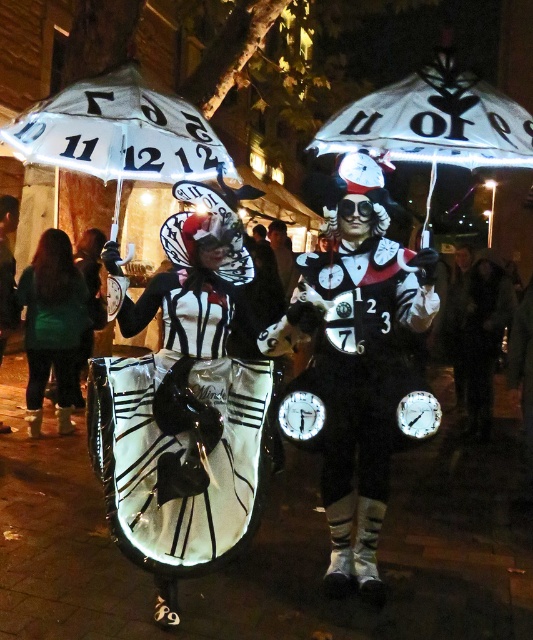
You are standing in the nighttime scene and need to find the exact location of the matte black fabric dress at center. According to the coordinates provided, where is it positioned?

The matte black fabric dress at center is located at point coordinates of 0.683 on the x axis and 0.340 on the y axis.

You are standing in the nighttime scene and need to locate the matte black costume at center. According to the coordinates provided, where exactly would you find it?

The matte black costume at center is located at point coordinates of 0.558 on the x axis and 0.675 on the y axis.

Looking at this image, you are standing in the nighttime scene with the two clock costume individuals. You notice two points marked in the image. The first point is at coordinates point (373, 252) and the second is at point (33, 285). Which point is closer to you?

Point (373, 252) is in front of point (33, 285), so the first point is closer to you.